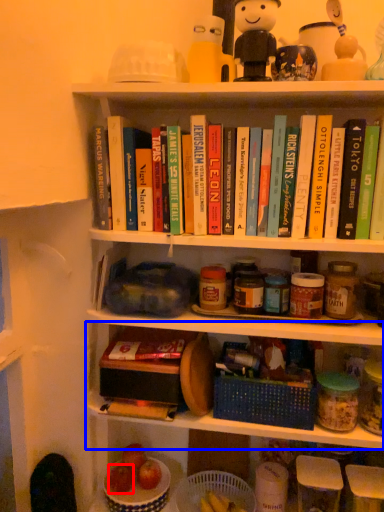
Question: Which object appears farthest to the camera in this image, apple (highlighted by a red box) or shelf (highlighted by a blue box)?

Choices:
 (A) apple
 (B) shelf

Answer: (A)